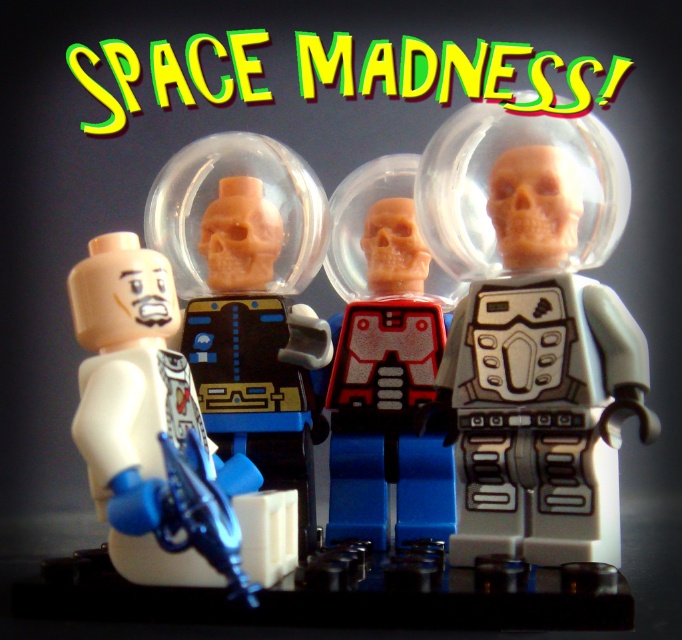
You are an astronaut trying to find your way through a dark space station. You see a translucent plastic astronaut at center and a white matte astronaut at left. Which astronaut is more to the right?

The translucent plastic astronaut at center is positioned on the right side of the white matte astronaut at left.

You are a space explorer who needs to reach the white matte astronaut at left from the matte black astronaut at center. The minimum distance you can travel is 10 inches. Can you safely reach them without exceeding your travel limit?

The distance between the matte black astronaut at center and the white matte astronaut at left is 9.22 inches, which is less than the minimum travel distance of 10 inches. Therefore, you cannot safely reach them without exceeding your travel limit.

You are a spacecraft engineer designing a storage compartment for two astronauts. The compartment has a width of 1.2 meters. You see the matte black astronaut at center and the white matte astronaut at left. Can both astronauts fit side by side in the compartment?

The matte black astronaut at center is wider than the white matte astronaut at left. Therefore, both astronauts might not fit side by side in the 1.2 meter wide compartment as their combined width could exceed the available space.